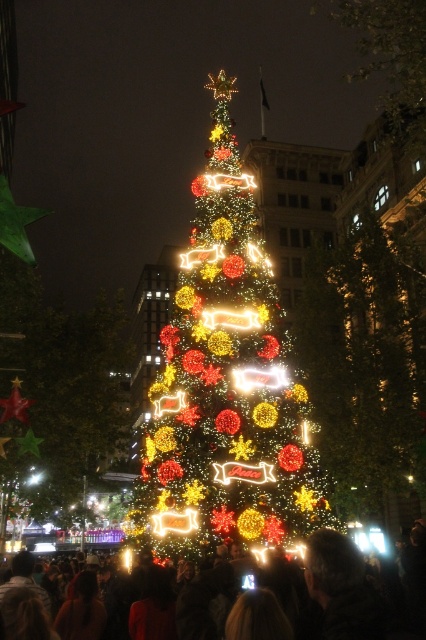
Is point (328, 595) behind point (417, 140)?

No, it is not.

How much distance is there between matte black crowd at center and illuminated plastic tree at upper center?

matte black crowd at center and illuminated plastic tree at upper center are 96.10 meters apart.

Which is in front, point (204, 592) or point (416, 36)?

Point (204, 592)

Locate an element on the screen. The width and height of the screenshot is (426, 640). matte black crowd at center is located at coordinates (356, 589).

Who is taller, illuminated plastic christmas tree at center or illuminated plastic ornaments at center?

illuminated plastic christmas tree at center is taller.

Which is above, illuminated plastic christmas tree at center or illuminated plastic ornaments at center?

illuminated plastic christmas tree at center is higher up.

Is point (253, 259) closer to viewer compared to point (0, 296)?

Yes.

Identify the location of illuminated plastic christmas tree at center. (226, 385).

Does illuminated plastic christmas tree at center have a larger size compared to illuminated plastic tree at upper center?

→ Incorrect, illuminated plastic christmas tree at center is not larger than illuminated plastic tree at upper center.

Who is positioned more to the left, illuminated plastic christmas tree at center or illuminated plastic tree at upper center?

illuminated plastic christmas tree at center is more to the left.

Is point (287, 337) farther from viewer compared to point (406, 17)?

No, (287, 337) is in front of (406, 17).

This screenshot has height=640, width=426. I want to click on illuminated plastic christmas tree at center, so click(x=226, y=385).